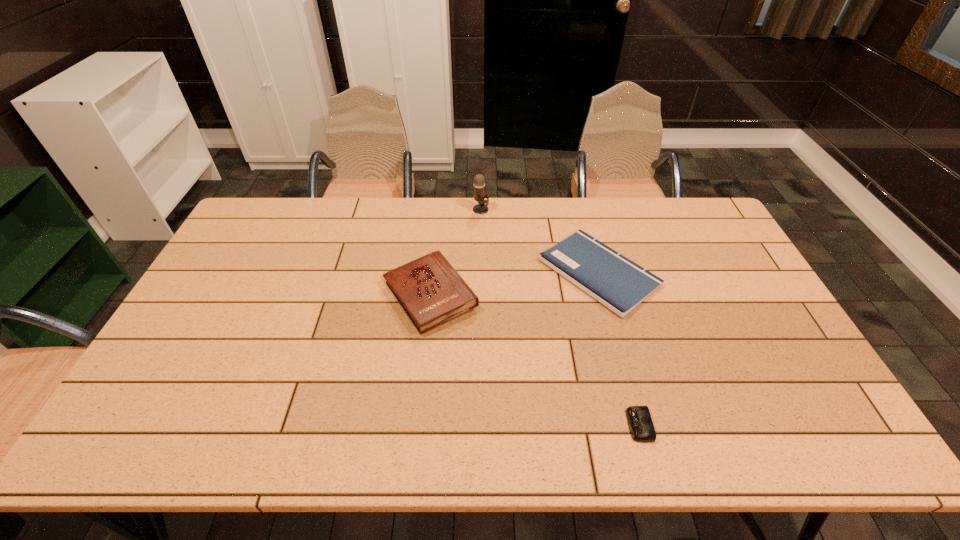
You are a GUI agent. You are given a task and a screenshot of the screen. Output one action in this format:
    pyautogui.click(x=<x>, y=<y>)
    Task: Click on the free spot located on the display of the nearest object
    
    Given the screenshot: What is the action you would take?
    pyautogui.click(x=527, y=425)

Find the location of a particular element. The height and width of the screenshot is (540, 960). free region located 0.050m on the display of the nearest object is located at coordinates (607, 425).

Where is `microphone positioned at the far edge`? This screenshot has width=960, height=540. microphone positioned at the far edge is located at coordinates 479,181.

This screenshot has height=540, width=960. What are the coordinates of `paperback book present at the far edge` in the screenshot? It's located at (615, 281).

Where is `object positioned at the near edge`? object positioned at the near edge is located at coordinates (641, 426).

The height and width of the screenshot is (540, 960). In the image, there is a desktop. Find the location of `free space at the far edge`. free space at the far edge is located at coordinates (551, 210).

In the image, there is a desktop. Identify the location of vacant region at the near edge. This screenshot has height=540, width=960. (395, 420).

You are a GUI agent. You are given a task and a screenshot of the screen. Output one action in this format:
    pyautogui.click(x=<x>, y=<y>)
    Task: Click on the vacant space at the left edge
    The width and height of the screenshot is (960, 540).
    Given the screenshot: What is the action you would take?
    pyautogui.click(x=161, y=370)

Find the location of a particular element. The image size is (960, 540). free region at the right edge of the desktop is located at coordinates (746, 340).

In order to click on free space at the far left corner of the desktop in this screenshot , I will do `click(257, 208)`.